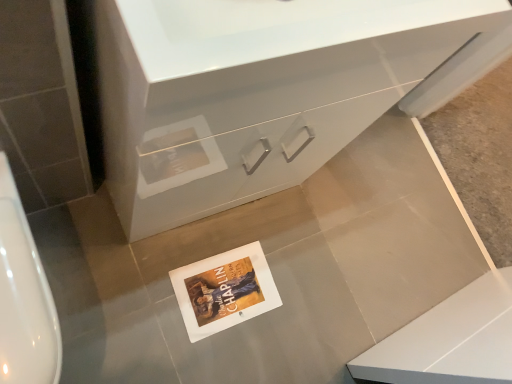
Where is `vacant space underneath white paper postcard at center (from a real-world perspective)`? This screenshot has width=512, height=384. vacant space underneath white paper postcard at center (from a real-world perspective) is located at coordinates (226, 288).